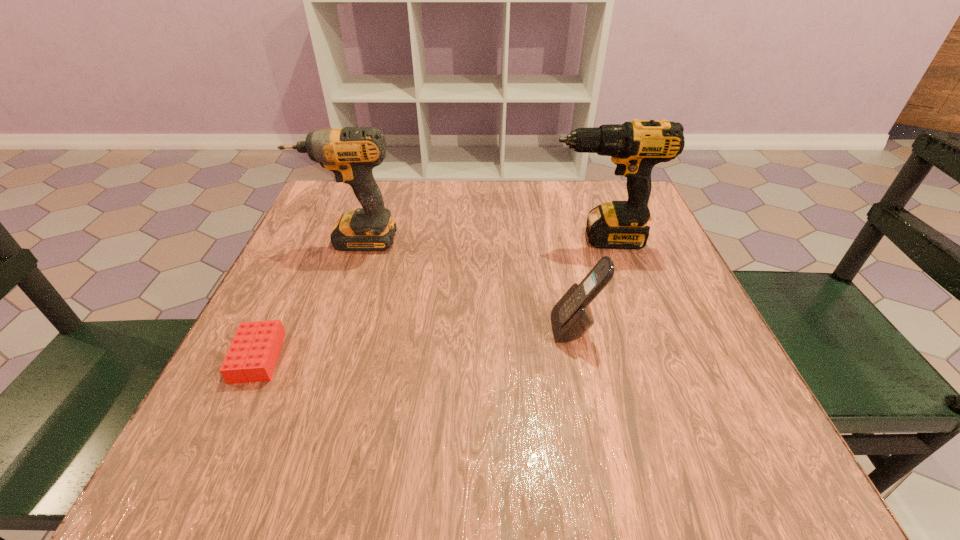
You are a GUI agent. You are given a task and a screenshot of the screen. Output one action in this format:
    pyautogui.click(x=<x>, y=<y>)
    Task: Click on the right drill
    The image size is (960, 540).
    Given the screenshot: What is the action you would take?
    (635, 147)

Image resolution: width=960 pixels, height=540 pixels. I want to click on the left drill, so click(351, 153).

What are the coordinates of `the third tallest object` in the screenshot? It's located at (571, 317).

You are a GUI agent. You are given a task and a screenshot of the screen. Output one action in this format:
    pyautogui.click(x=<x>, y=<y>)
    Task: Click on the shortest object
    Image resolution: width=960 pixels, height=540 pixels.
    Given the screenshot: What is the action you would take?
    pyautogui.click(x=252, y=356)

Find the location of a particular element. This screenshot has height=540, width=960. vacant space situated at the tip of the right drill is located at coordinates (408, 239).

Identify the location of free space located at the tip of the right drill. Image resolution: width=960 pixels, height=540 pixels. (504, 239).

Locate an element on the screen. Image resolution: width=960 pixels, height=540 pixels. free spot located 0.390m at the tip of the right drill is located at coordinates (377, 239).

Locate an element on the screen. vacant space located on the front-facing side of the second shortest object is located at coordinates (425, 328).

At what (x,y) coordinates should I click in order to perform the action: click on free location located 0.360m on the front-facing side of the second shortest object. Please return your answer as a coordinate pair (x, y). The image size is (960, 540). Looking at the image, I should click on (353, 328).

This screenshot has width=960, height=540. Find the location of `vacant space located 0.060m on the front-facing side of the second shortest object`. vacant space located 0.060m on the front-facing side of the second shortest object is located at coordinates (519, 328).